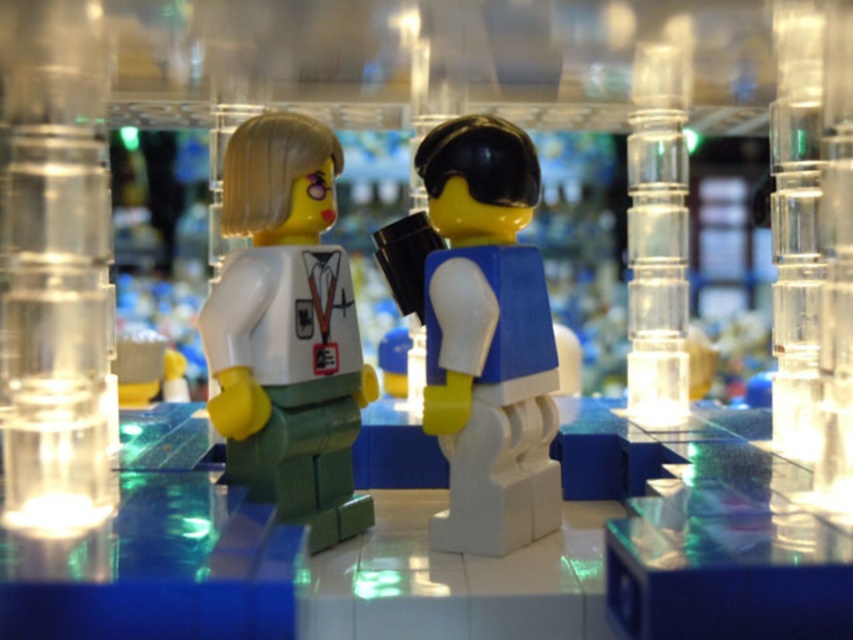
Where is `white matte/soft plastic figurine at center`? Image resolution: width=853 pixels, height=640 pixels. white matte/soft plastic figurine at center is located at coordinates (287, 330).

Is white matte/soft plastic figurine at center to the left of transparent plastic pillar at right from the viewer's perspective?

Indeed, white matte/soft plastic figurine at center is positioned on the left side of transparent plastic pillar at right.

The height and width of the screenshot is (640, 853). What do you see at coordinates (287, 330) in the screenshot?
I see `white matte/soft plastic figurine at center` at bounding box center [287, 330].

Locate an element on the screen. The width and height of the screenshot is (853, 640). white matte/soft plastic figurine at center is located at coordinates (287, 330).

Who is lower down, blue matte backpack at center or white matte/soft plastic figurine at center?

Positioned lower is blue matte backpack at center.

Is blue matte backpack at center to the left of white matte/soft plastic figurine at center from the viewer's perspective?

No, blue matte backpack at center is not to the left of white matte/soft plastic figurine at center.

Is point (433, 236) closer to viewer compared to point (316, 509)?

No, (433, 236) is further to viewer.

Where is `blue matte backpack at center`? The height and width of the screenshot is (640, 853). blue matte backpack at center is located at coordinates (480, 332).

Is point (457, 429) positioned in front of point (648, 260)?

Yes, it is.

Describe the element at coordinates (480, 332) in the screenshot. The height and width of the screenshot is (640, 853). I see `blue matte backpack at center` at that location.

At what (x,y) coordinates should I click in order to perform the action: click on blue matte backpack at center. Please return your answer as a coordinate pair (x, y). The height and width of the screenshot is (640, 853). Looking at the image, I should click on (480, 332).